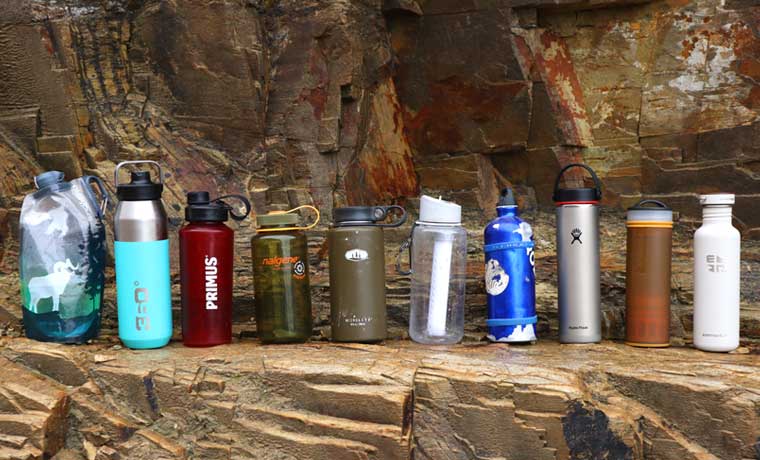
Find the location of a particular element. drinking bottles is located at coordinates (55, 264), (140, 286), (207, 290), (289, 292), (359, 290), (437, 290), (521, 291), (590, 291), (640, 294), (717, 300).